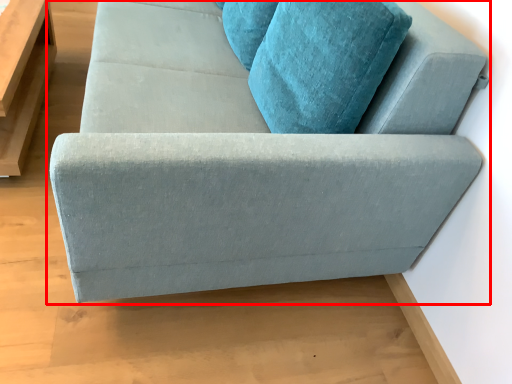
Question: In this image, where is studio couch (annotated by the red box) located relative to table?

Choices:
 (A) right
 (B) left

Answer: (A)